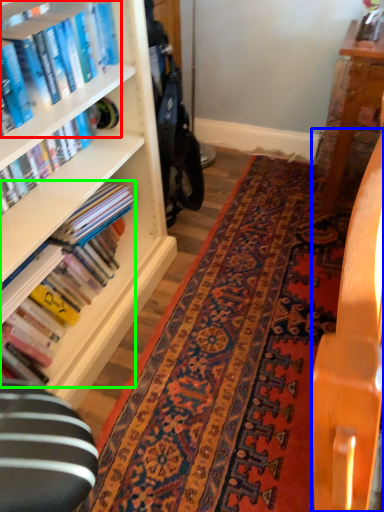
Question: Estimate the real-world distances between objects in this image. Which object is farther from book (highlighted by a red box), table (highlighted by a blue box) or book (highlighted by a green box)?

Choices:
 (A) table
 (B) book

Answer: (A)